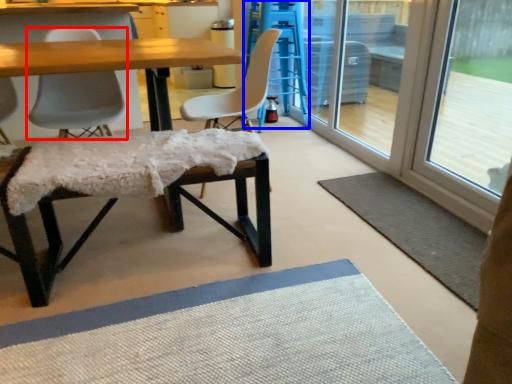
Question: Which of the following is the farthest to the observer, chair (highlighted by a red box) or bar stool (highlighted by a blue box)?

Choices:
 (A) chair
 (B) bar stool

Answer: (B)